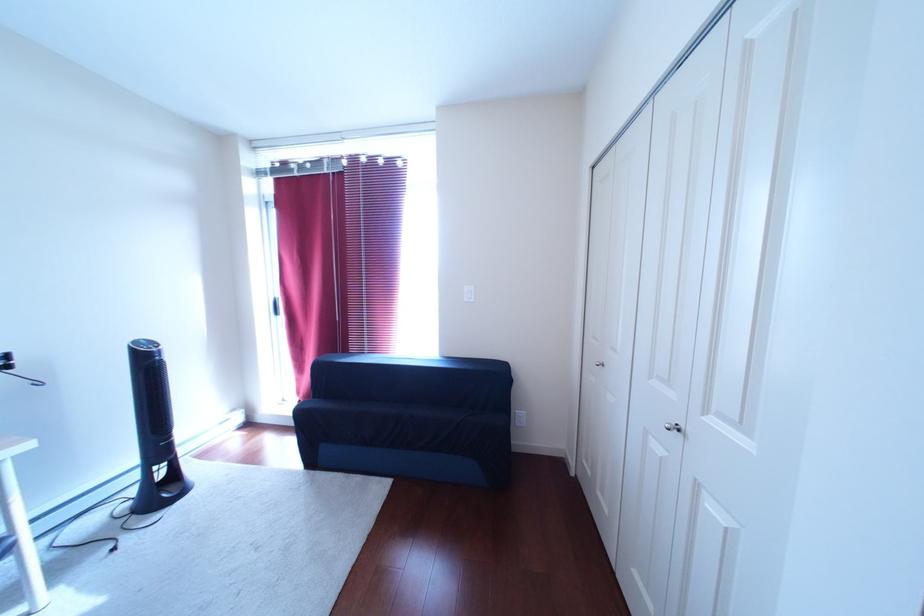
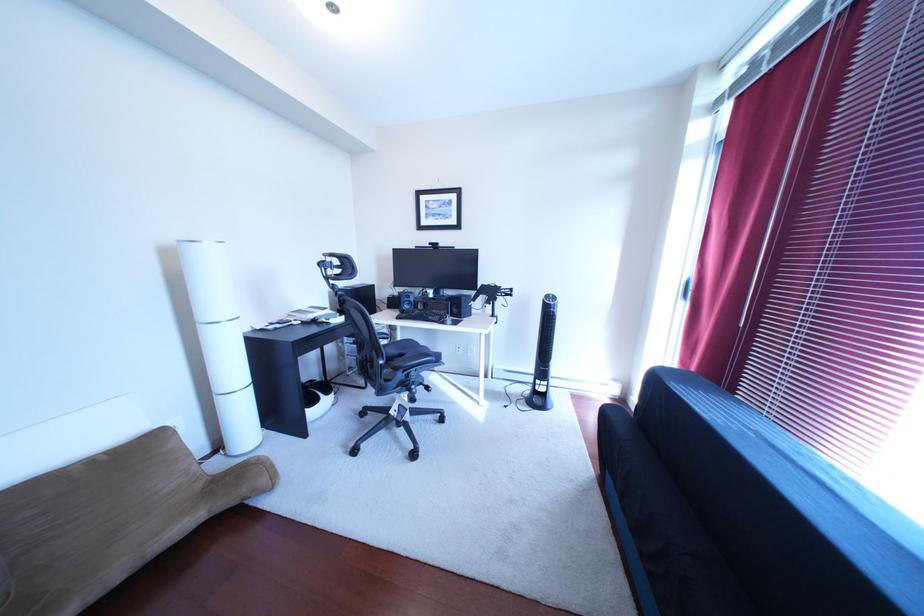
Question: Based on the continuous images, in which direction is the camera rotating? Reply with the corresponding letter.

Choices:
 (A) Left
 (B) Right
 (C) Up
 (D) Down

Answer: (A)